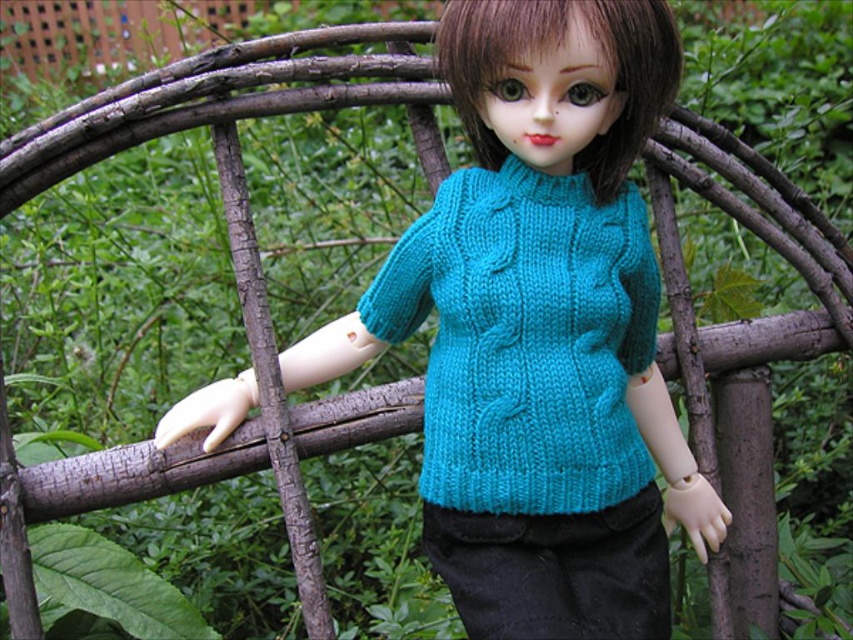
Question: Which object is closer to the camera taking this photo?

Choices:
 (A) turquoise knitted sweater at center
 (B) teal knitted sweater at center

Answer: (B)

Question: Among these points, which one is nearest to the camera?

Choices:
 (A) (517, 163)
 (B) (610, 440)

Answer: (B)

Question: Which point is closer to the camera?

Choices:
 (A) (642, 362)
 (B) (579, 516)

Answer: (B)

Question: Can you confirm if teal knitted sweater at center is smaller than turquoise knitted sweater at center?

Choices:
 (A) yes
 (B) no

Answer: (B)

Question: Does teal knitted sweater at center appear on the left side of turquoise knitted sweater at center?

Choices:
 (A) yes
 (B) no

Answer: (A)

Question: Is teal knitted sweater at center below turquoise knitted sweater at center?

Choices:
 (A) no
 (B) yes

Answer: (B)